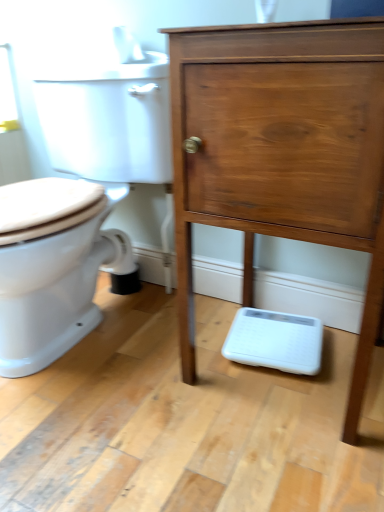
Question: Considering the relative sizes of matte wood chest of drawers at center and white glossy toilet at left in the image provided, is matte wood chest of drawers at center thinner than white glossy toilet at left?

Choices:
 (A) no
 (B) yes

Answer: (B)

Question: From a real-world perspective, is matte wood chest of drawers at center located beneath white glossy toilet at left?

Choices:
 (A) no
 (B) yes

Answer: (A)

Question: Is matte wood chest of drawers at center facing towards white glossy toilet at left?

Choices:
 (A) no
 (B) yes

Answer: (A)

Question: Are matte wood chest of drawers at center and white glossy toilet at left located far from each other?

Choices:
 (A) yes
 (B) no

Answer: (B)

Question: Can you confirm if matte wood chest of drawers at center is taller than white glossy toilet at left?

Choices:
 (A) no
 (B) yes

Answer: (B)

Question: Is white glossy toilet at left completely or partially inside matte wood chest of drawers at center?

Choices:
 (A) yes
 (B) no

Answer: (B)

Question: Is white glossy toilet at left positioned before matte wood chest of drawers at center?

Choices:
 (A) yes
 (B) no

Answer: (B)

Question: Can you confirm if white glossy toilet at left is positioned to the left of matte wood chest of drawers at center?

Choices:
 (A) no
 (B) yes

Answer: (B)

Question: From a real-world perspective, is white glossy toilet at left physically below matte wood chest of drawers at center?

Choices:
 (A) no
 (B) yes

Answer: (B)

Question: Is white glossy toilet at left not near matte wood chest of drawers at center?

Choices:
 (A) no
 (B) yes

Answer: (A)

Question: Can you confirm if white glossy toilet at left is bigger than matte wood chest of drawers at center?

Choices:
 (A) yes
 (B) no

Answer: (A)

Question: From the image's perspective, does white glossy toilet at left appear higher than matte wood chest of drawers at center?

Choices:
 (A) yes
 (B) no

Answer: (A)

Question: Visually, is white glossy toilet at left positioned to the left or to the right of matte wood chest of drawers at center?

Choices:
 (A) right
 (B) left

Answer: (B)